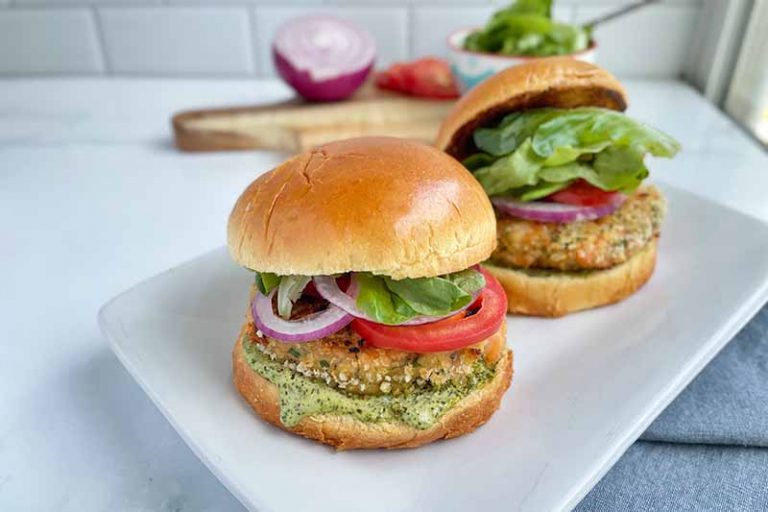
The width and height of the screenshot is (768, 512). I want to click on bowl of lettuce, so click(543, 36).